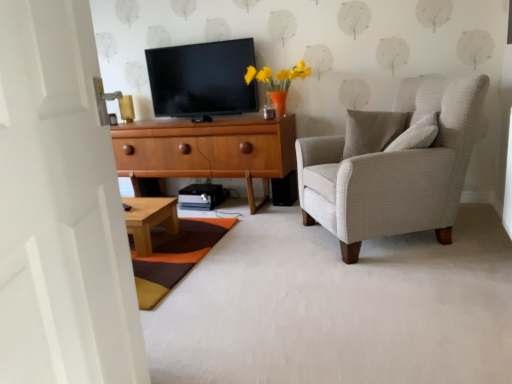
At what (x,y) coordinates should I click in order to perform the action: click on vacant space underneath black glossy tv at upper center (from a real-world perspective). Please return your answer as a coordinate pair (x, y). This screenshot has width=512, height=384. Looking at the image, I should click on coord(216,112).